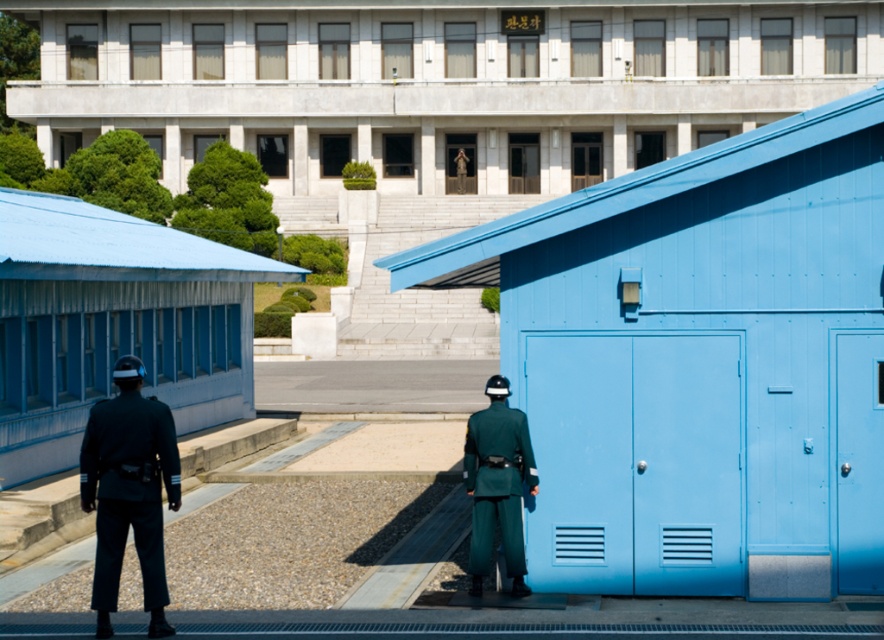
Question: Which is farther from the green matte uniform at center?

Choices:
 (A) blue wooden hut at center-right
 (B) blue corrugated metal hut at center
 (C) matte blue hut at left
 (D) dark green fabric uniform at left

Answer: (B)

Question: Does blue corrugated metal hut at center have a larger size compared to green matte uniform at center?

Choices:
 (A) yes
 (B) no

Answer: (A)

Question: Among these points, which one is farthest from the camera?

Choices:
 (A) (834, 42)
 (B) (471, 472)
 (C) (135, 529)
 (D) (496, 234)

Answer: (A)

Question: From the image, what is the correct spatial relationship of blue corrugated metal hut at center in relation to green matte uniform at center?

Choices:
 (A) above
 (B) below

Answer: (A)

Question: Which point is farther to the camera?

Choices:
 (A) (557, 522)
 (B) (528, 444)
 (C) (159, 605)
 (D) (275, 260)

Answer: (D)

Question: Is dark green fabric uniform at left closer to the viewer compared to green matte uniform at center?

Choices:
 (A) no
 (B) yes

Answer: (B)